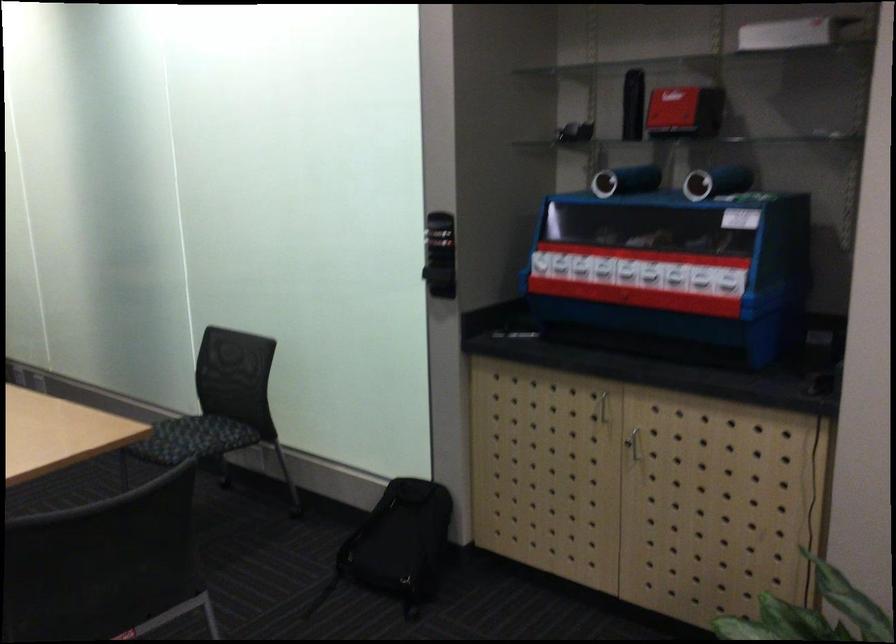
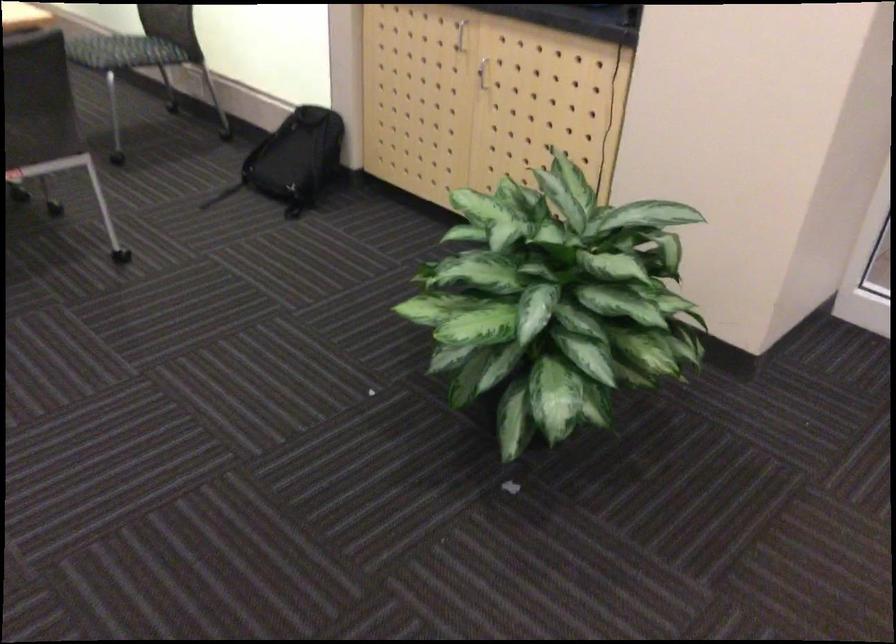
What movement of the cameraman would produce the second image?

The cameraman moved toward right, backward.